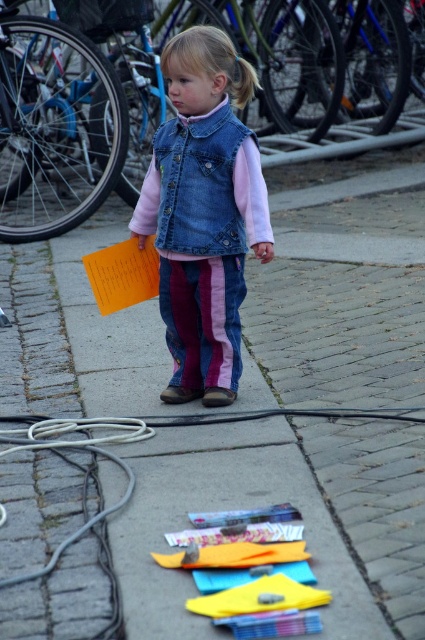
Between denim vest at center and yellow fabric toy at lower center, which one is positioned lower?

Positioned lower is yellow fabric toy at lower center.

Between denim vest at center and yellow fabric toy at lower center, which one appears on the right side from the viewer's perspective?

yellow fabric toy at lower center

Identify the location of denim vest at center. (204, 212).

At what (x,y) coordinates should I click in order to perform the action: click on denim vest at center. Please return your answer as a coordinate pair (x, y). The width and height of the screenshot is (425, 640). Looking at the image, I should click on (204, 212).

Between denim vest at center and denim jacket at center, which one appears on the right side from the viewer's perspective?

denim jacket at center is more to the right.

Is point (226, 376) more distant than point (173, 168)?

That is True.

The height and width of the screenshot is (640, 425). In order to click on denim vest at center in this screenshot , I will do `click(204, 212)`.

Who is more distant from viewer, (227, 170) or (260, 554)?

Point (227, 170)

Does denim jacket at center have a larger size compared to yellow fabric toy at lower center?

Indeed, denim jacket at center has a larger size compared to yellow fabric toy at lower center.

Which is behind, point (218, 225) or point (309, 580)?

Positioned behind is point (218, 225).

I want to click on denim jacket at center, so click(201, 184).